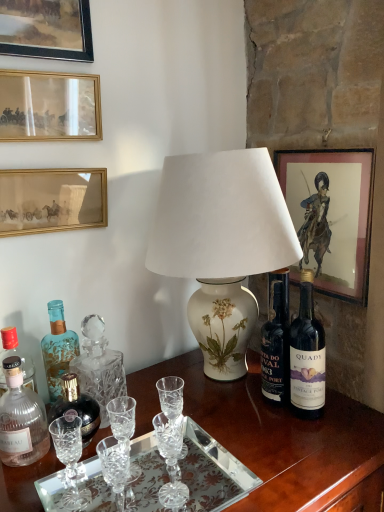
Question: Can you confirm if wooden desk at center is wider than matte glass bottle at center-left, arranged as the 2th bottle when viewed from the back?

Choices:
 (A) yes
 (B) no

Answer: (A)

Question: Is wooden desk at center looking in the opposite direction of matte glass bottle at center-left, placed as the 2th bottle when sorted from front to back?

Choices:
 (A) no
 (B) yes

Answer: (A)

Question: Does wooden desk at center turn towards matte glass bottle at center-left, arranged as the 2th bottle when viewed from the back?

Choices:
 (A) no
 (B) yes

Answer: (A)

Question: Is wooden desk at center closer to the viewer compared to matte glass bottle at center-left, arranged as the 2th bottle when viewed from the back?

Choices:
 (A) yes
 (B) no

Answer: (A)

Question: Considering the relative positions of wooden desk at center and matte glass bottle at center-left, placed as the 2th bottle when sorted from front to back, in the image provided, is wooden desk at center to the right of matte glass bottle at center-left, placed as the 2th bottle when sorted from front to back, from the viewer's perspective?

Choices:
 (A) yes
 (B) no

Answer: (A)

Question: Does wooden desk at center have a lesser height compared to matte glass bottle at center-left, placed as the 2th bottle when sorted from front to back?

Choices:
 (A) no
 (B) yes

Answer: (A)

Question: Is translucent glass bottle at left, marked as the 1th bottle in a front-to-back arrangement, thinner than clear crystal wine glass at center?

Choices:
 (A) yes
 (B) no

Answer: (B)

Question: Considering the relative positions of translucent glass bottle at left, marked as the 1th bottle in a front-to-back arrangement, and clear crystal wine glass at center in the image provided, is translucent glass bottle at left, marked as the 1th bottle in a front-to-back arrangement, to the left of clear crystal wine glass at center from the viewer's perspective?

Choices:
 (A) yes
 (B) no

Answer: (A)

Question: Does translucent glass bottle at left, the third bottle viewed from the back, have a larger size compared to clear crystal wine glass at center?

Choices:
 (A) yes
 (B) no

Answer: (A)

Question: Does translucent glass bottle at left, marked as the 1th bottle in a front-to-back arrangement, appear on the right side of clear crystal wine glass at center?

Choices:
 (A) yes
 (B) no

Answer: (B)

Question: Is translucent glass bottle at left, marked as the 1th bottle in a front-to-back arrangement, positioned beyond the bounds of clear crystal wine glass at center?

Choices:
 (A) no
 (B) yes

Answer: (B)

Question: Is translucent glass bottle at left, the third bottle viewed from the back, not close to clear crystal wine glass at center?

Choices:
 (A) no
 (B) yes

Answer: (A)

Question: Is matte paper picture frame at upper right, acting as the 4th picture frame starting from the left, smaller than matte glass picture frame at upper left, the 2th picture frame from the left?

Choices:
 (A) no
 (B) yes

Answer: (A)